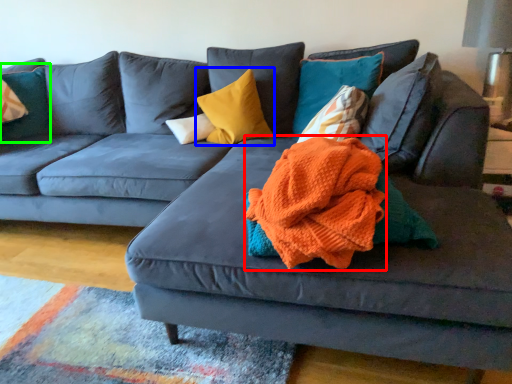
Question: Which object is the farthest from blanket (highlighted by a red box)? Choose among these: pillow (highlighted by a blue box) or pillow (highlighted by a green box).

Choices:
 (A) pillow
 (B) pillow

Answer: (B)